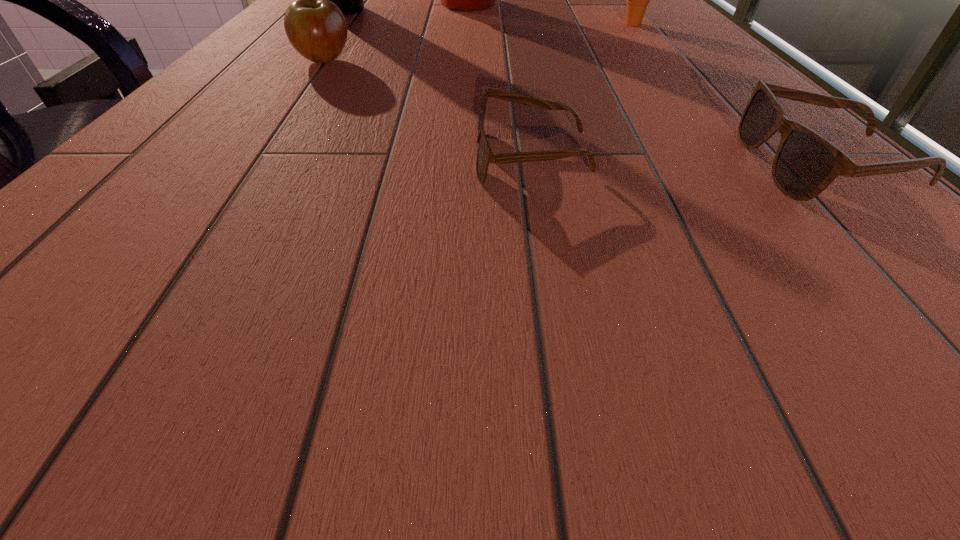
I want to click on vacant space that's between the apple and the shorter sunglasses, so click(x=427, y=109).

Identify the location of object that is the fourth closest to the icecream. The width and height of the screenshot is (960, 540). (316, 28).

Image resolution: width=960 pixels, height=540 pixels. Identify the location of object that is the fifth closest to the fire extinguisher. (805, 164).

Identify the location of blank space that satisfies the following two spatial constraints: 1. on the front-facing side of the liquor; 2. on the right side of the third nearest object. This screenshot has height=540, width=960. tap(303, 61).

You are a GUI agent. You are given a task and a screenshot of the screen. Output one action in this format:
    pyautogui.click(x=<x>, y=<y>)
    Task: Click on the free location that satisfies the following two spatial constraints: 1. on the back side of the third farthest object; 2. on the front-facing side of the fifth shortest object
    This screenshot has width=960, height=540.
    Given the screenshot: What is the action you would take?
    pyautogui.click(x=621, y=10)

Identify the location of vacant position in the image that satisfies the following two spatial constraints: 1. on the front-facing side of the fifth shortest object; 2. on the right side of the fourth tallest object. The width and height of the screenshot is (960, 540). (303, 61).